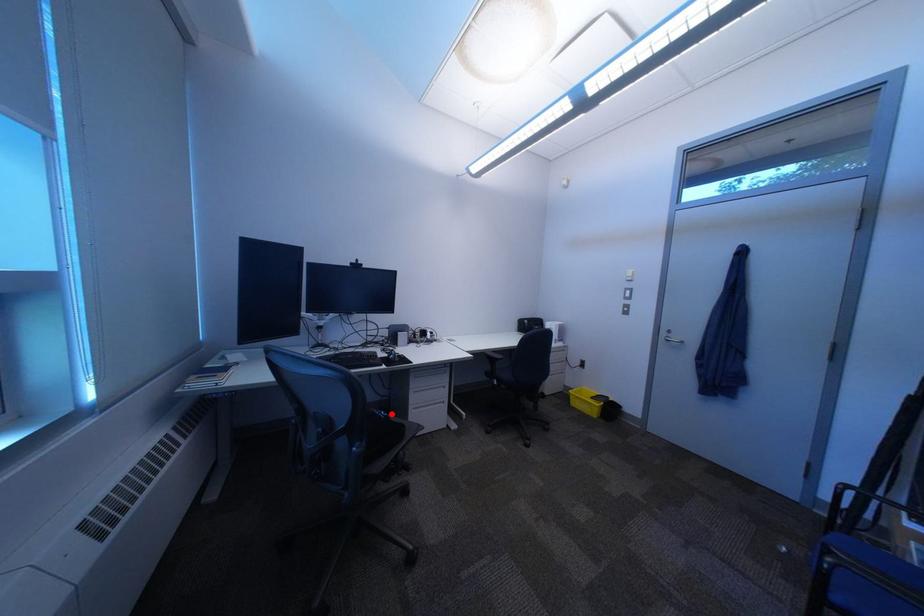
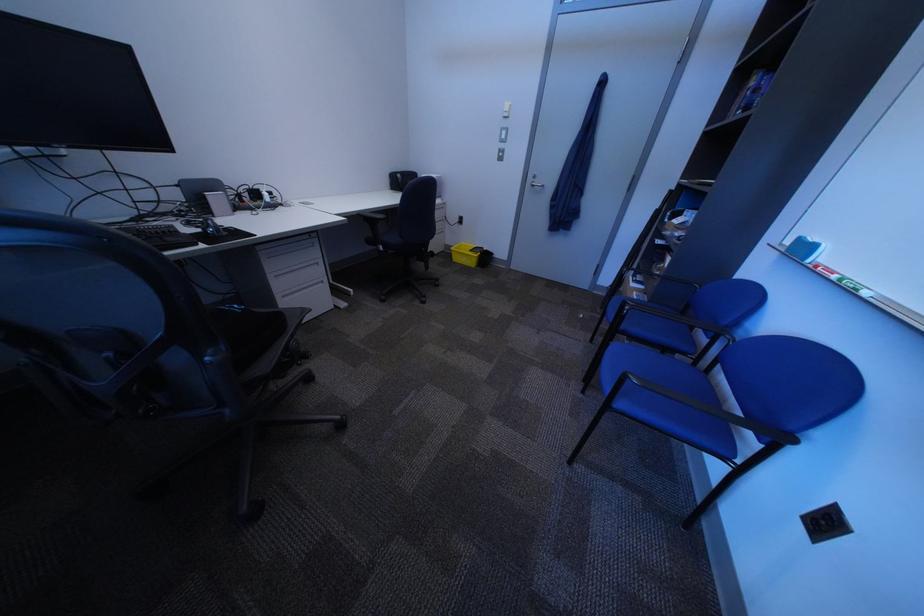
Question: I am providing you with two images of the same scene from different viewpoints. Given a red point in image1, look at the same physical point in image2. Is it:

Choices:
 (A) Closer to the viewpoint
 (B) Farther from the viewpoint

Answer: (B)